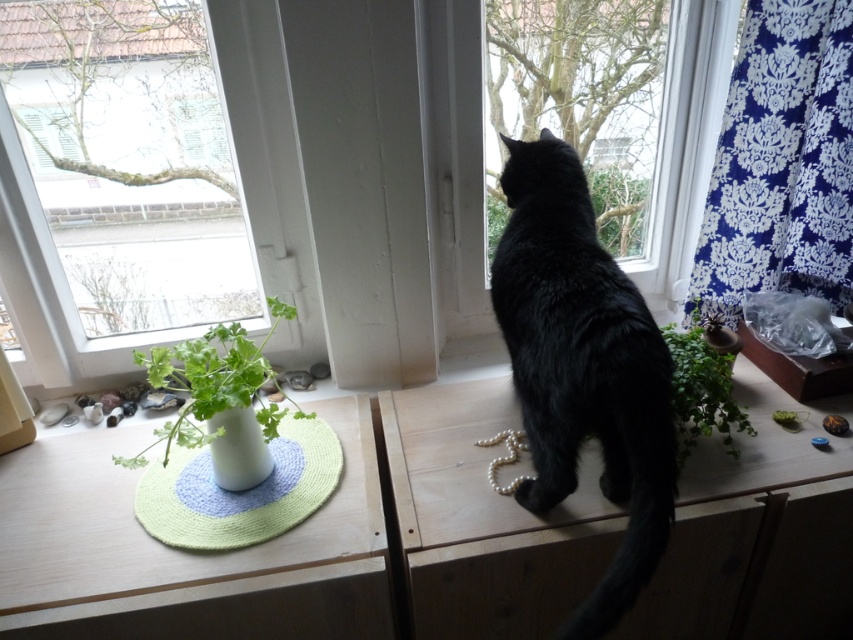
Question: Which of these objects is positioned farthest from the green leafy plant at center?

Choices:
 (A) transparent glass window at upper left
 (B) blue damask fabric at upper right
 (C) black fur cat at center
 (D) white glossy vase at lower left

Answer: (A)

Question: Is green knitted mat at lower left closer to the viewer compared to white glossy vase at lower left?

Choices:
 (A) yes
 (B) no

Answer: (B)

Question: Estimate the real-world distances between objects in this image. Which object is closer to the green leafy plant at center?

Choices:
 (A) transparent glass window at center
 (B) green knitted mat at lower left
 (C) white glossy vase at center

Answer: (A)

Question: Estimate the real-world distances between objects in this image. Which object is closer to the blue damask fabric at upper right?

Choices:
 (A) green leafy plant at center
 (B) black fur cat at center
 (C) white glossy vase at lower left

Answer: (A)

Question: Does transparent glass window at center have a greater width compared to white glossy vase at lower left?

Choices:
 (A) yes
 (B) no

Answer: (A)

Question: Is black fur cat at center thinner than green knitted mat at lower left?

Choices:
 (A) yes
 (B) no

Answer: (A)